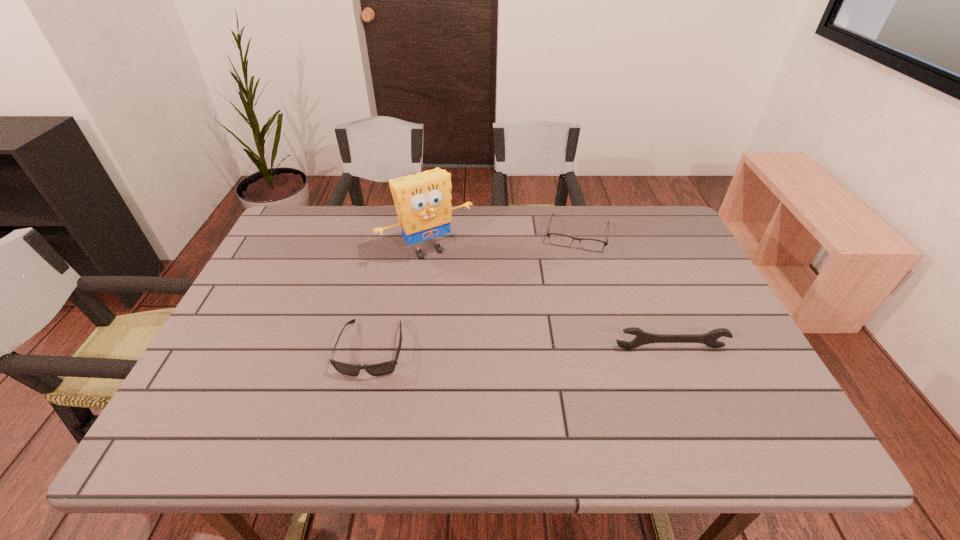
Find the location of a particular element. The height and width of the screenshot is (540, 960). free space on the desktop that is between the sunglasses and the wrench and is positioned on the front-facing side of the spectacles is located at coordinates (558, 348).

Where is `vacant spot on the desktop that is between the sunglasses and the second tallest object and is positioned on the face of the tallest object`? vacant spot on the desktop that is between the sunglasses and the second tallest object and is positioned on the face of the tallest object is located at coordinates (498, 348).